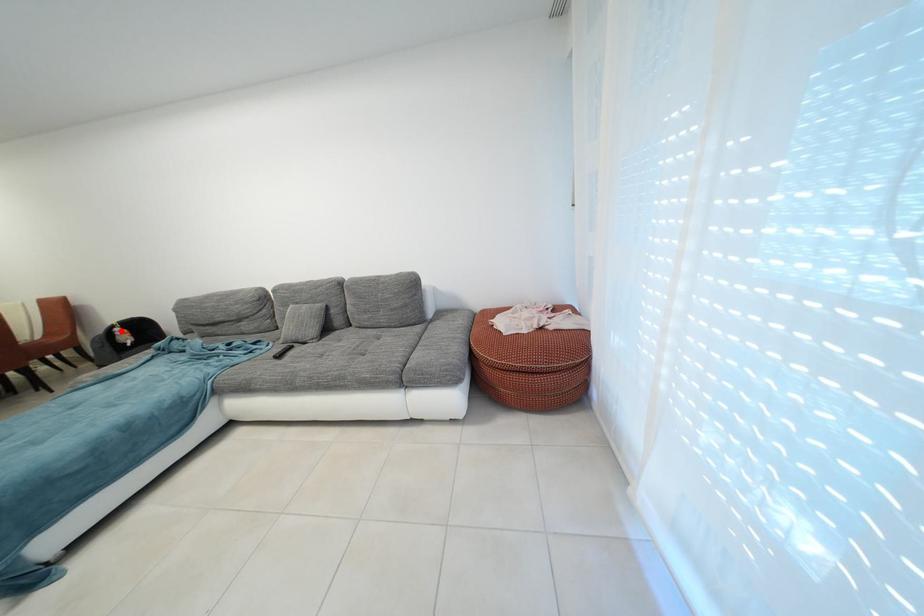
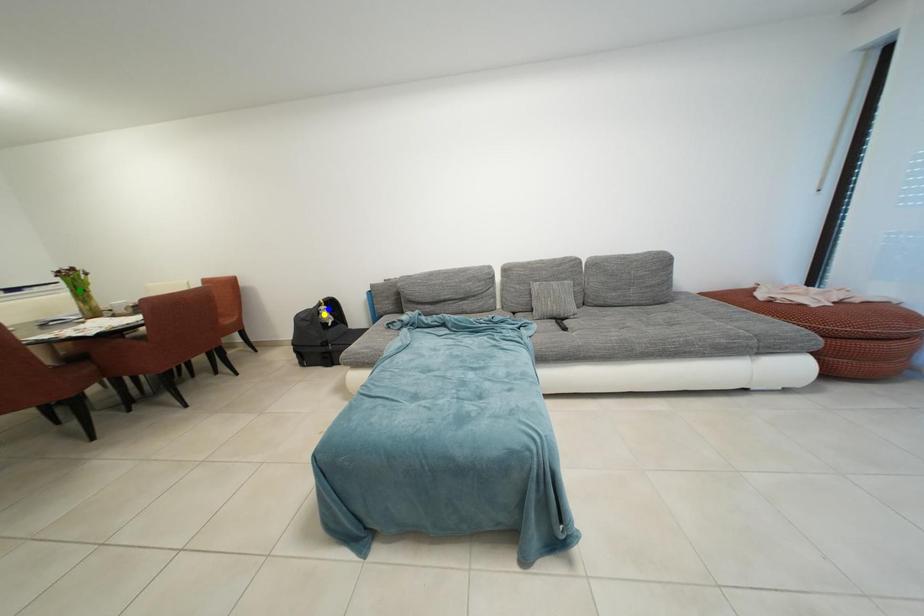
Question: I am providing you with two images of the same scene from different viewpoints. A red point is marked on the first image. You are given multiple points on the second image. Which point in image 2 is actually the same real-world point as the red point in image 1?

Choices:
 (A) yellow point
 (B) blue point
 (C) green point

Answer: (B)